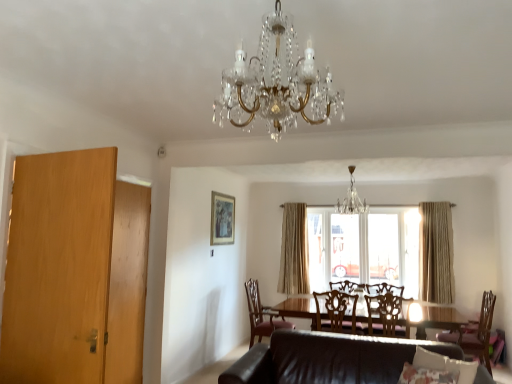
Question: From the image's perspective, is fluffy fabric pillow at lower center located above or below beige fabric curtain at center, placed as the first curtain when sorted from back to front?

Choices:
 (A) below
 (B) above

Answer: (A)

Question: Is fluffy fabric pillow at lower center in front of or behind beige fabric curtain at center, placed as the first curtain when sorted from back to front, in the image?

Choices:
 (A) front
 (B) behind

Answer: (A)

Question: Estimate the real-world distances between objects in this image. Which object is farther from the brown leather chair at lower center, arranged as the fourth chair when viewed from the right?

Choices:
 (A) transparent glass window at center
 (B) wooden chair at center, marked as the third chair in a left-to-right arrangement
 (C) wooden door at left
 (D) crystal glass chandelier at center, which ranks as the 1th chandelier in back-to-front order
 (E) leather couch at lower center

Answer: (C)

Question: Which is nearer to the crystal/glass chandelier at center, which is counted as the first chandelier, starting from the front?

Choices:
 (A) beige fabric curtain at center, placed as the first curtain when sorted from back to front
 (B) wooden chair at center, which is counted as the second chair, starting from the left
 (C) brown leather chair at lower center, the first chair when ordered from left to right
 (D) light brown wood armoire at left
 (E) wooden chair at center, which appears as the second chair when viewed from the right

Answer: (D)